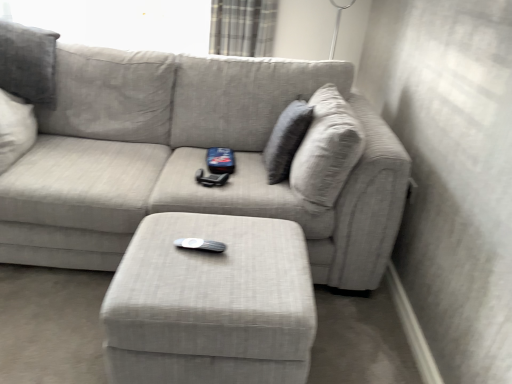
Question: Are plaid fabric curtain at upper center and matte gray ottoman at center making contact?

Choices:
 (A) no
 (B) yes

Answer: (A)

Question: Is plaid fabric curtain at upper center shorter than matte gray ottoman at center?

Choices:
 (A) no
 (B) yes

Answer: (B)

Question: Is plaid fabric curtain at upper center positioned behind matte gray ottoman at center?

Choices:
 (A) yes
 (B) no

Answer: (A)

Question: Is plaid fabric curtain at upper center aimed at matte gray ottoman at center?

Choices:
 (A) no
 (B) yes

Answer: (B)

Question: Are plaid fabric curtain at upper center and matte gray ottoman at center located far from each other?

Choices:
 (A) no
 (B) yes

Answer: (B)

Question: From a real-world perspective, is plaid fabric curtain at upper center positioned under matte gray ottoman at center based on gravity?

Choices:
 (A) no
 (B) yes

Answer: (A)

Question: Does textured gray couch at center appear on the left side of textured gray pillow at upper right?

Choices:
 (A) no
 (B) yes

Answer: (B)

Question: From a real-world perspective, is textured gray couch at center beneath textured gray pillow at upper right?

Choices:
 (A) yes
 (B) no

Answer: (A)

Question: Can you confirm if textured gray couch at center is thinner than textured gray pillow at upper right?

Choices:
 (A) yes
 (B) no

Answer: (B)

Question: Does textured gray couch at center have a smaller size compared to textured gray pillow at upper right?

Choices:
 (A) yes
 (B) no

Answer: (B)

Question: Is textured gray couch at center at the right side of textured gray pillow at upper right?

Choices:
 (A) yes
 (B) no

Answer: (B)

Question: Is textured gray couch at center facing towards textured gray pillow at upper right?

Choices:
 (A) no
 (B) yes

Answer: (B)

Question: Would you say plaid fabric curtain at upper center is outside textured gray pillow at upper right?

Choices:
 (A) yes
 (B) no

Answer: (A)